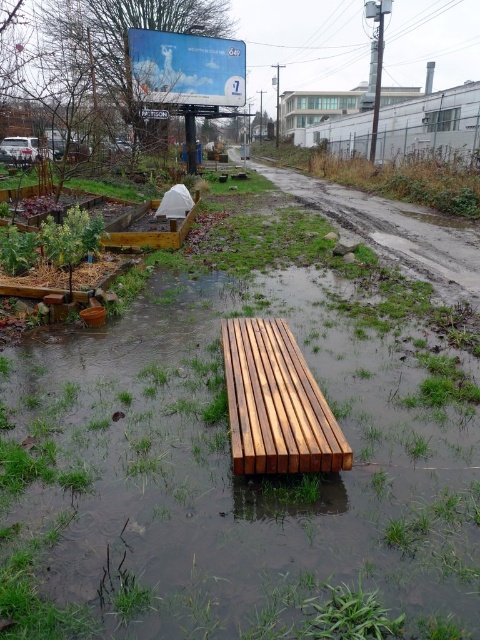
Question: Estimate the real-world distances between objects in this image. Which object is farther from the light brown wooden bench at center?

Choices:
 (A) matte blue billboard at upper center
 (B) wooden bench at center

Answer: (A)

Question: Can you confirm if wooden bench at center is bigger than matte blue billboard at upper center?

Choices:
 (A) no
 (B) yes

Answer: (A)

Question: Does wooden bench at center have a lesser width compared to light brown wooden bench at center?

Choices:
 (A) no
 (B) yes

Answer: (A)

Question: Which object is farther from the camera taking this photo?

Choices:
 (A) wooden bench at center
 (B) matte blue billboard at upper center

Answer: (B)

Question: Which object is positioned closest to the wooden bench at center?

Choices:
 (A) matte blue billboard at upper center
 (B) light brown wooden bench at center

Answer: (B)

Question: Does wooden bench at center appear under matte blue billboard at upper center?

Choices:
 (A) yes
 (B) no

Answer: (A)